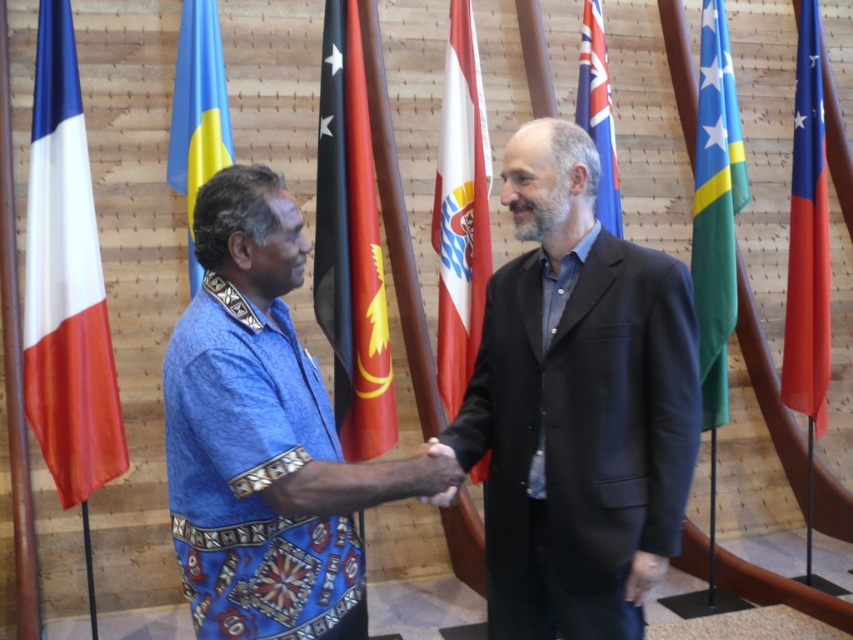
Which is below, dark blue suit at center or tricolor fabric flag at left?

Positioned lower is dark blue suit at center.

Does dark blue suit at center lie behind tricolor fabric flag at left?

No, dark blue suit at center is in front of tricolor fabric flag at left.

Does point (672, 323) lie in front of point (57, 488)?

Yes, point (672, 323) is closer to viewer.

At what (x,y) coordinates should I click in order to perform the action: click on dark blue suit at center. Please return your answer as a coordinate pair (x, y). Looking at the image, I should click on (577, 404).

Is white/red/striped flag at center wider than red fabric flag at right?

Indeed, white/red/striped flag at center has a greater width compared to red fabric flag at right.

Is point (448, 333) closer to viewer compared to point (787, 376)?

Yes, it is.

This screenshot has height=640, width=853. I want to click on white/red/striped flag at center, so click(x=460, y=211).

Is tricolor fabric flag at left to the left of blue fabric flag at left from the viewer's perspective?

Indeed, tricolor fabric flag at left is positioned on the left side of blue fabric flag at left.

Does tricolor fabric flag at left appear on the right side of blue fabric flag at left?

No, tricolor fabric flag at left is not to the right of blue fabric flag at left.

Identify the location of tricolor fabric flag at left. (67, 282).

You are a GUI agent. You are given a task and a screenshot of the screen. Output one action in this format:
    pyautogui.click(x=<x>, y=<y>)
    Task: Click on the tricolor fabric flag at left
    
    Given the screenshot: What is the action you would take?
    pyautogui.click(x=67, y=282)